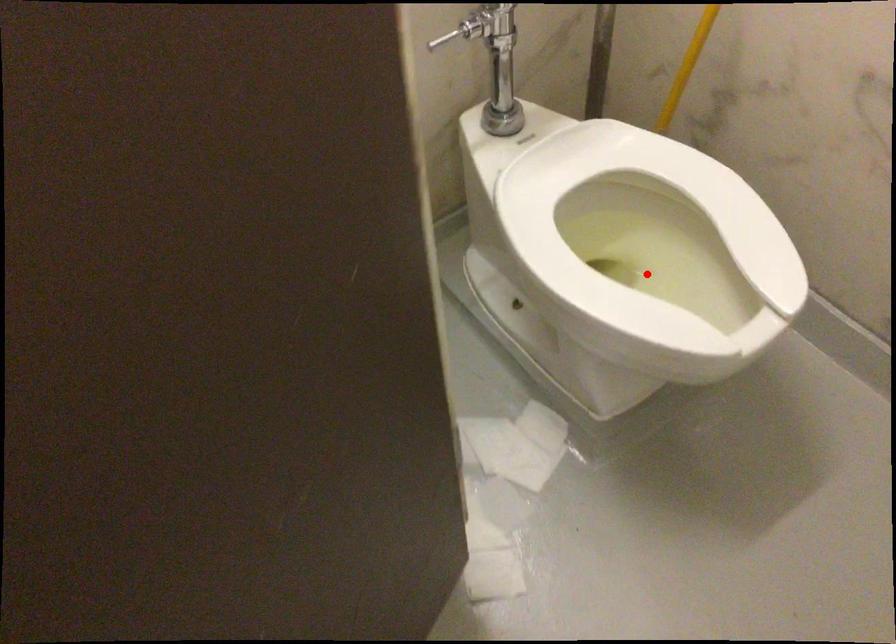
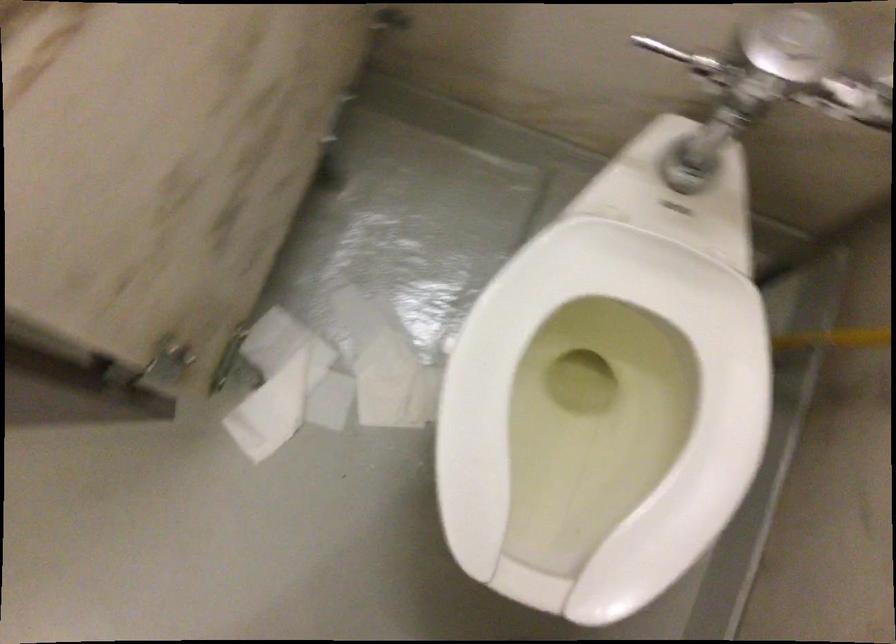
Question: I am providing you with two images of the same scene from different viewpoints. Image1 has a red point marked. In image2, the corresponding 3D location appears at what relative position? Reply with the corresponding letter.

Choices:
 (A) Closer
 (B) Farther

Answer: (A)